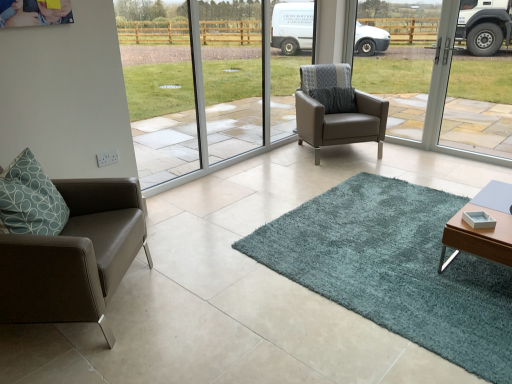
Question: Do you think teal shaggy rug at center is within matte brown leather chair at left, placed as the first chair when sorted from bottom to top, or outside of it?

Choices:
 (A) inside
 (B) outside

Answer: (B)

Question: Visually, is teal shaggy rug at center positioned to the left or to the right of matte brown leather chair at left, the second chair in the right-to-left sequence?

Choices:
 (A) right
 (B) left

Answer: (A)

Question: Which object is positioned farthest from the teal shaggy rug at center?

Choices:
 (A) matte gray leather armchair at center, which is the 1th chair in top-to-bottom order
 (B) transparent glass window at center
 (C) matte brown leather chair at left, placed as the first chair when sorted from bottom to top
 (D) wooden table at lower right

Answer: (B)

Question: Which of these objects is positioned farthest from the matte gray leather armchair at center, the 2th chair positioned from the bottom?

Choices:
 (A) wooden table at lower right
 (B) matte brown leather chair at left, the second chair in the right-to-left sequence
 (C) transparent glass window at center
 (D) teal shaggy rug at center

Answer: (B)